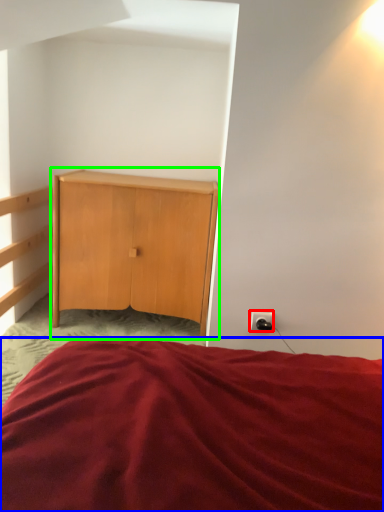
Question: Which object is the closest to the electric outlet (highlighted by a red box)? Choose among these: bed (highlighted by a blue box) or nightstand (highlighted by a green box).

Choices:
 (A) bed
 (B) nightstand

Answer: (A)